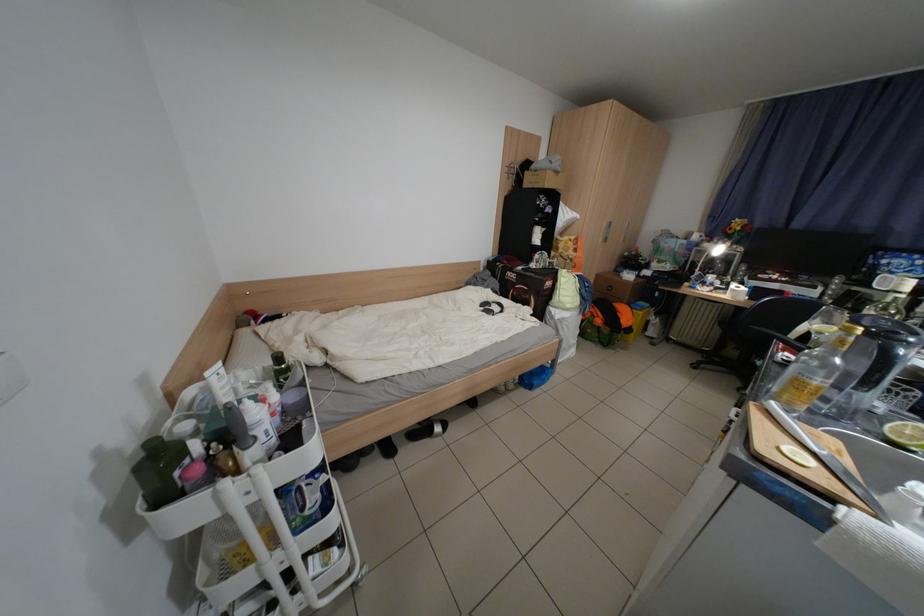
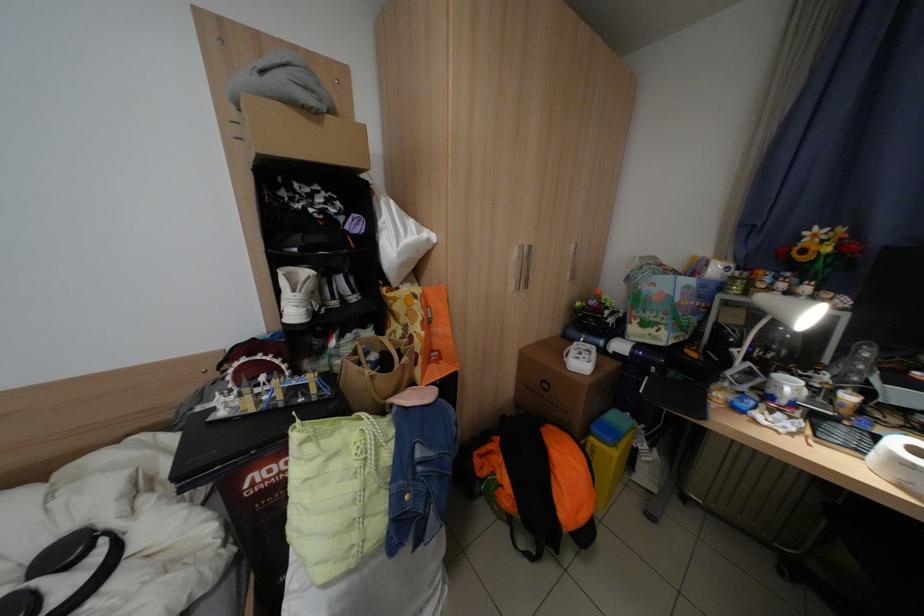
Where in the second image is the point corresponding to point (642, 306) from the first image?

(604, 430)